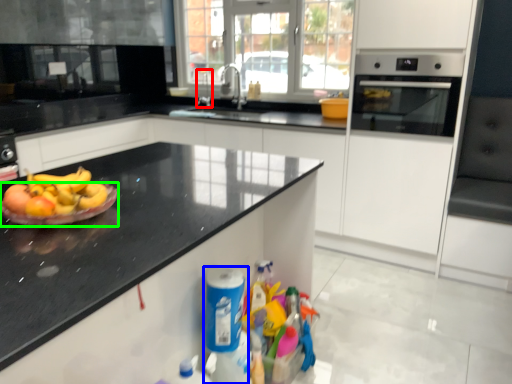
Question: Which is nearer to the faucet (highlighted by a red box)? cleaning product (highlighted by a blue box) or paper plate (highlighted by a green box).

Choices:
 (A) cleaning product
 (B) paper plate

Answer: (A)